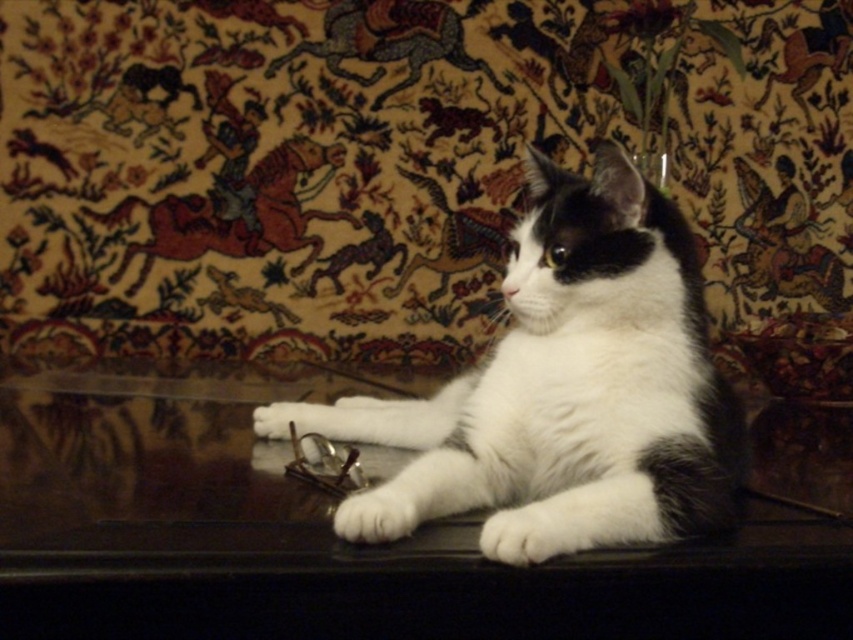
Question: Based on their relative distances, which object is nearer to the white fur at lower center?

Choices:
 (A) white fur paw at lower center
 (B) white fur cat at center
 (C) glossy dark wood table at center

Answer: (A)

Question: Which object appears farthest from the camera in this image?

Choices:
 (A) white fur paw at lower center
 (B) white fur cat at center
 (C) white fur at lower center

Answer: (B)

Question: Is white fur at lower center below white fur paw at lower center?

Choices:
 (A) yes
 (B) no

Answer: (A)

Question: Does white fur at lower center have a smaller size compared to white fur paw at lower center?

Choices:
 (A) no
 (B) yes

Answer: (A)

Question: Is white fur at lower center thinner than white fur paw at lower center?

Choices:
 (A) no
 (B) yes

Answer: (A)

Question: Which is nearer to the white fur paw at lower center?

Choices:
 (A) glossy dark wood table at center
 (B) white fur cat at center

Answer: (B)